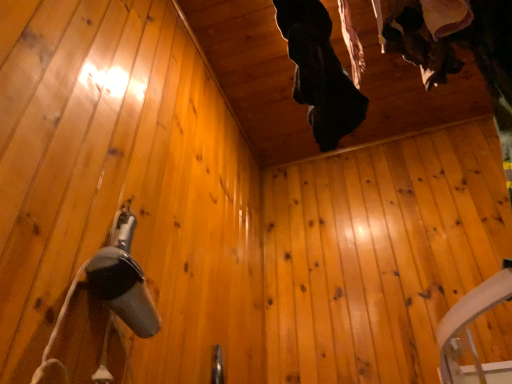
What is the approximate height of dark fabric shoe at upper center?

The height of dark fabric shoe at upper center is 18.82 inches.

Where is `dark fabric shoe at upper center`? This screenshot has height=384, width=512. dark fabric shoe at upper center is located at coordinates (319, 72).

The image size is (512, 384). Describe the element at coordinates (319, 72) in the screenshot. I see `dark fabric shoe at upper center` at that location.

At what (x,y) coordinates should I click in order to perform the action: click on dark fabric shoe at upper center. Please return your answer as a coordinate pair (x, y). The image size is (512, 384). Looking at the image, I should click on (319, 72).